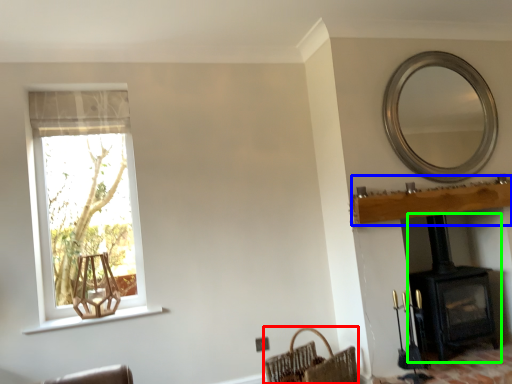
Question: Considering the real-world distances, which object is farthest from basket (highlighted by a red box)? mantle (highlighted by a blue box) or wood burning stove (highlighted by a green box)?

Choices:
 (A) mantle
 (B) wood burning stove

Answer: (A)